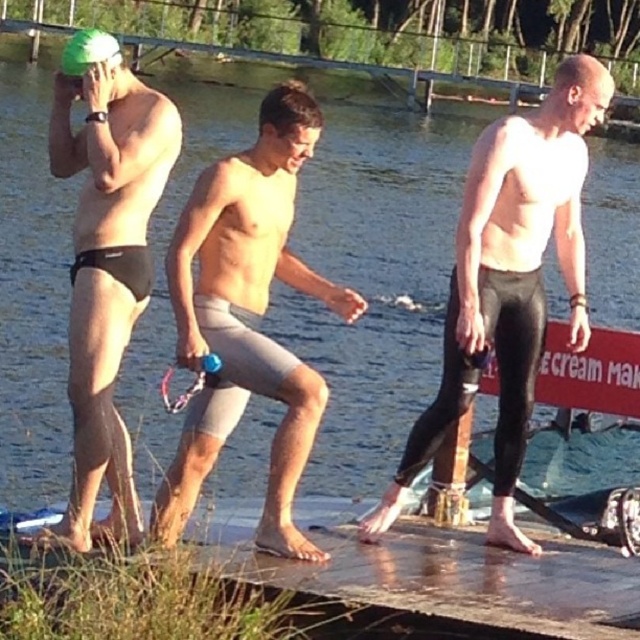
Question: Which is nearer to the gray matte shorts at center?

Choices:
 (A) black matte wetsuit at center
 (B) black matte swim cap at upper left

Answer: (A)

Question: From the image, what is the correct spatial relationship of gray matte shorts at center in relation to black matte swim cap at upper left?

Choices:
 (A) right
 (B) left

Answer: (A)

Question: Estimate the real-world distances between objects in this image. Which object is farther from the black matte wetsuit at center?

Choices:
 (A) green matte swim cap at upper left
 (B) gray matte shorts at center
 (C) wooden at center

Answer: (A)

Question: Where is black neoprene wetsuit at right located in relation to green matte swim cap at upper left in the image?

Choices:
 (A) right
 (B) left

Answer: (A)

Question: Can you confirm if black matte wetsuit at center is thinner than green matte swim cap at upper left?

Choices:
 (A) yes
 (B) no

Answer: (A)

Question: Which object is the closest to the gray matte shorts at center?

Choices:
 (A) black matte wetsuit at center
 (B) black matte swim cap at upper left

Answer: (A)